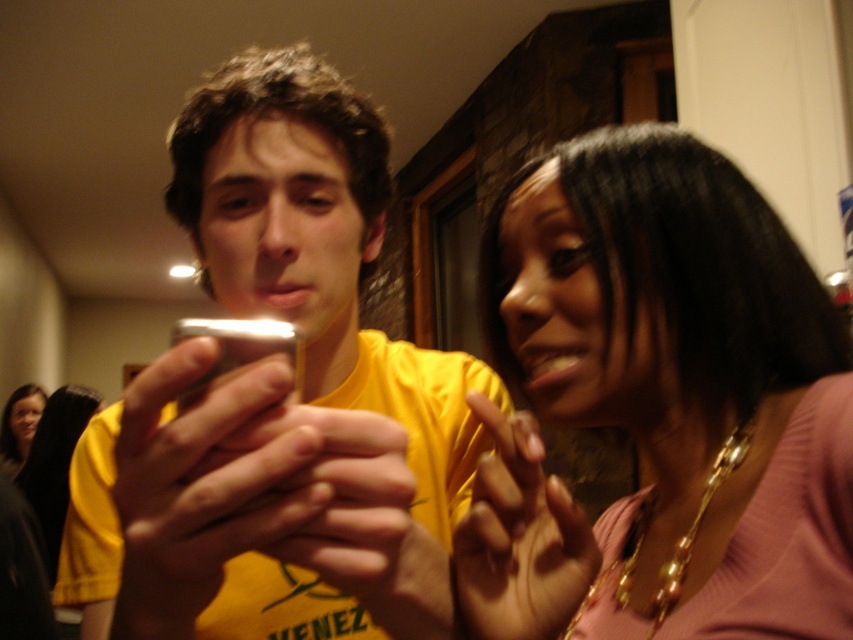
You are a fashion designer observing two people in a living room. You notice the matte pink sweater at center and the matte yellow shirt at center. Which clothing item has a narrower width?

The matte pink sweater at center is thinner than the matte yellow shirt at center, so the matte pink sweater at center has a narrower width.

You are a fashion designer observing two people in a living room. You notice the matte yellow shirt at center and the matte black hair at upper left. Which of these two items takes up more visual space in the image?

The matte black hair at upper left takes up more visual space than the matte yellow shirt at center because the matte yellow shirt at center occupies less space than matte black hair at upper left.